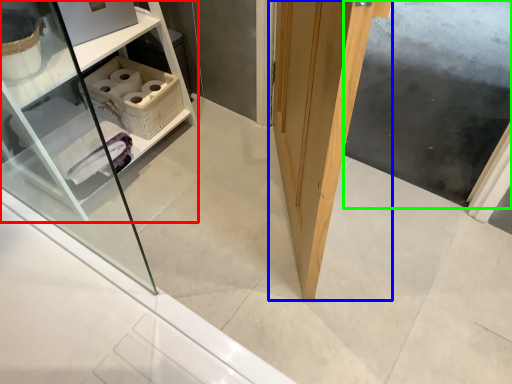
Question: Which object is positioned closest to shelf (highlighted by a red box)? Select from door (highlighted by a blue box) and screen door (highlighted by a green box).

Choices:
 (A) door
 (B) screen door

Answer: (A)